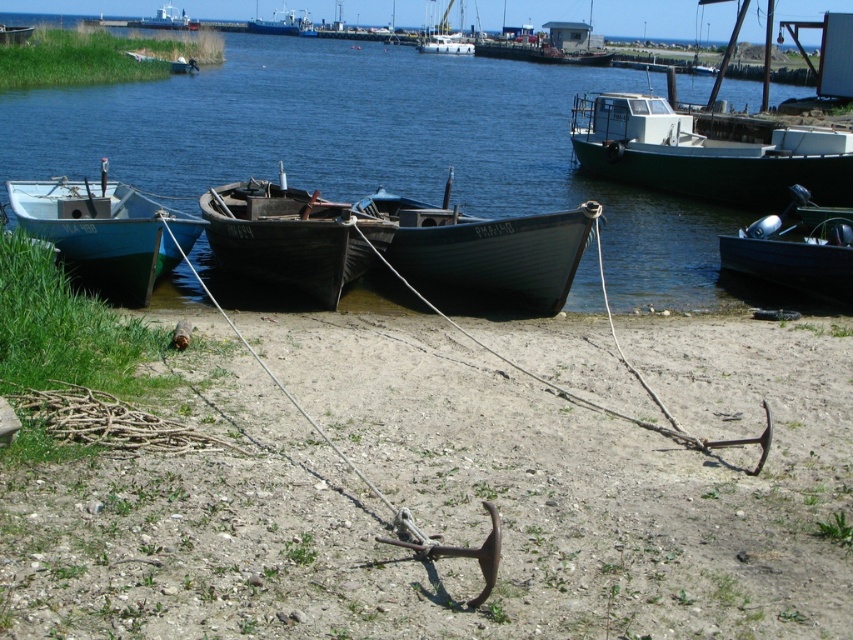
Question: Among these objects, which one is nearest to the camera?

Choices:
 (A) white glossy boat at upper center
 (B) dark gray wooden boat at center

Answer: (B)

Question: Considering the relative positions of green wooden boats at center and metallic gray dinghy at right in the image provided, where is green wooden boats at center located with respect to metallic gray dinghy at right?

Choices:
 (A) above
 (B) below

Answer: (A)

Question: Observing the image, what is the correct spatial positioning of dark gray wooden boat at center in reference to metallic gray dinghy at right?

Choices:
 (A) left
 (B) right

Answer: (A)

Question: Which object is farther from the camera taking this photo?

Choices:
 (A) brushed metal boat at upper left
 (B) dark gray wooden boat at center
 (C) metallic gray dinghy at right

Answer: (A)

Question: Is metallic gray dinghy at right wider than blue metallic boat at upper center?

Choices:
 (A) no
 (B) yes

Answer: (A)

Question: Which of the following is the closest to the observer?

Choices:
 (A) dark wood boat at center
 (B) blue metallic boat at upper center

Answer: (A)